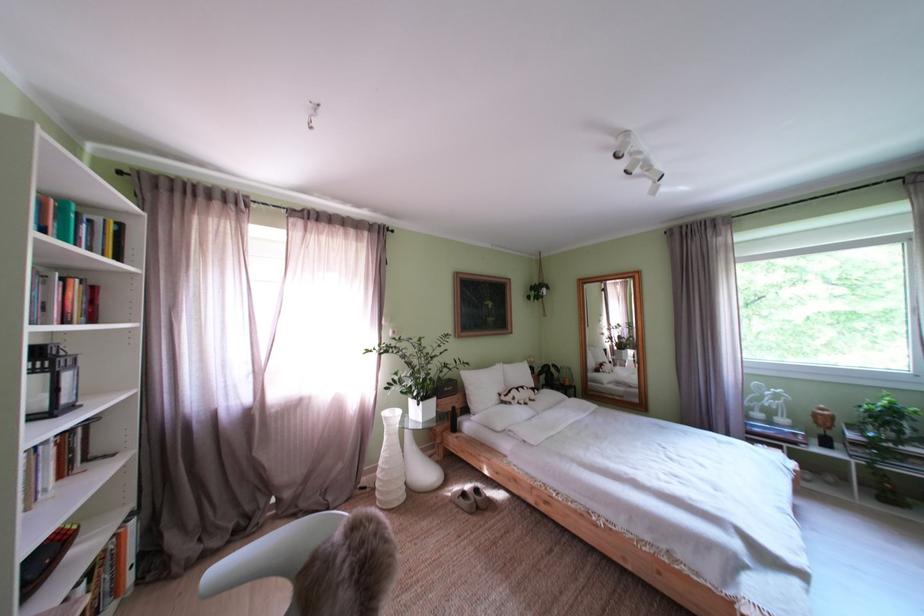
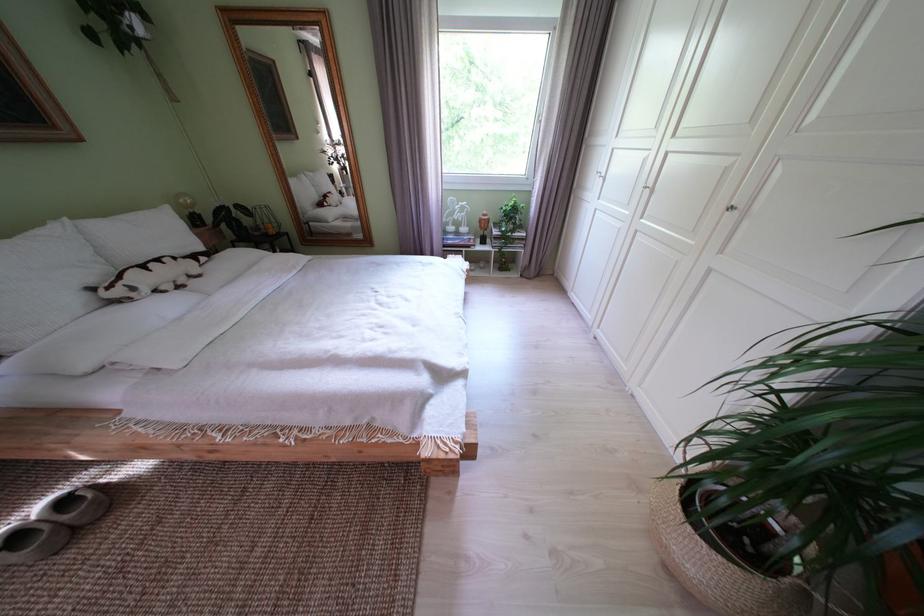
In the second image, find the point that corresponds to [475,500] in the first image.

(28, 543)